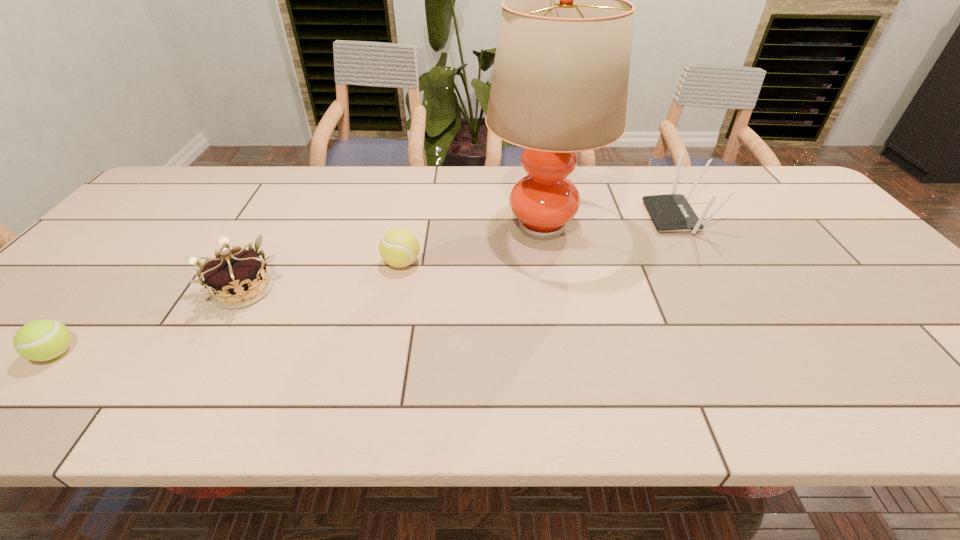
I want to click on free location located on the front-facing side of the router, so click(x=618, y=217).

The height and width of the screenshot is (540, 960). I want to click on vacant region located on the front-facing side of the router, so click(578, 217).

Identify the location of free space located 0.270m on the front-facing side of the router. The image size is (960, 540). (558, 217).

The height and width of the screenshot is (540, 960). Find the location of `vacant space located on the front of the third shortest object`. vacant space located on the front of the third shortest object is located at coordinates (170, 416).

Locate an element on the screen. blank space located on the left of the right tennis ball is located at coordinates (279, 263).

This screenshot has width=960, height=540. In order to click on free space located 0.260m on the right of the nearest object in this screenshot , I will do `click(199, 353)`.

I want to click on lamp that is at the far edge, so click(559, 86).

The width and height of the screenshot is (960, 540). Identify the location of router at the far edge. (671, 212).

Identify the location of object that is at the left edge. The width and height of the screenshot is (960, 540). [x=40, y=340].

Find the location of a particular element. The height and width of the screenshot is (540, 960). free location at the far edge of the desktop is located at coordinates (347, 198).